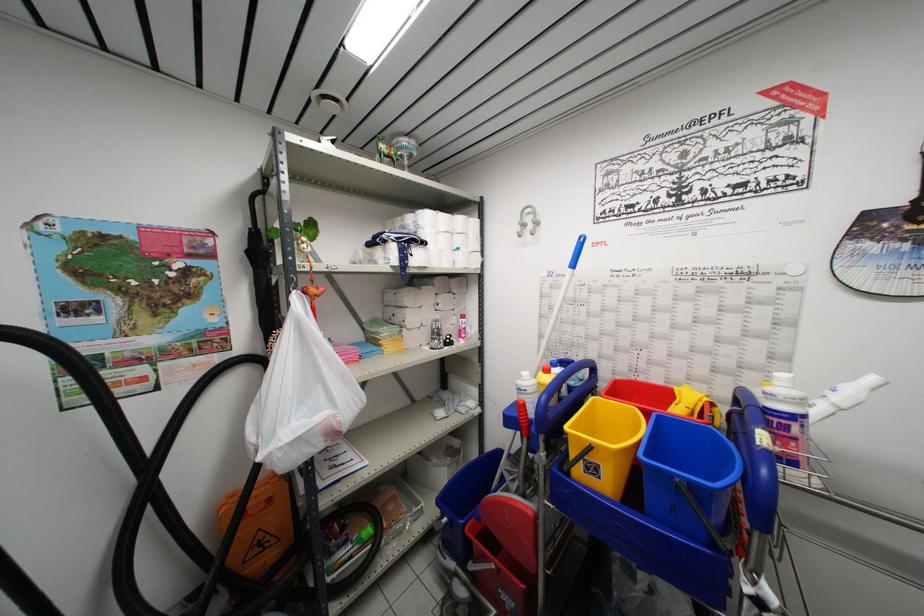
Where is `white spray bottle nozzle`? This screenshot has height=616, width=924. white spray bottle nozzle is located at coordinates (857, 416).